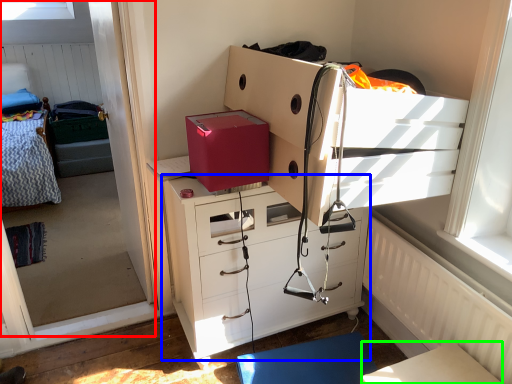
Question: Based on their relative distances, which object is nearer to window screen (highlighted by a red box)? Choose from chest of drawers (highlighted by a blue box) and table (highlighted by a green box).

Choices:
 (A) chest of drawers
 (B) table

Answer: (A)